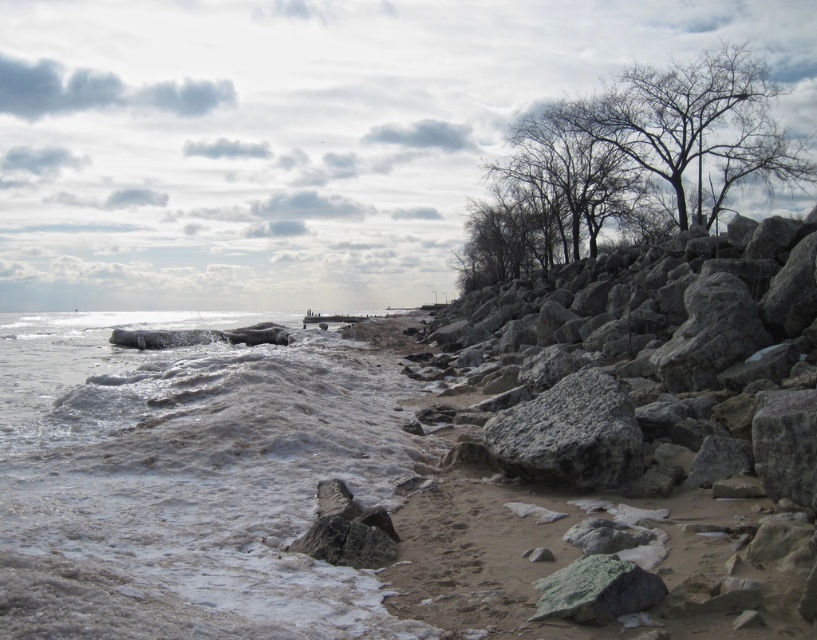
Is white frothy water at lower left in front of bare branches at upper right?

Yes, it is in front of bare branches at upper right.

Who is more distant from viewer, [192,458] or [570,120]?

The point [570,120] is behind.

Between point (240, 532) and point (653, 160), which one is positioned behind?

Positioned behind is point (653, 160).

At what (x,y) coordinates should I click in order to perform the action: click on white frothy water at lower left. Please return your answer as a coordinate pair (x, y). The height and width of the screenshot is (640, 817). Looking at the image, I should click on (184, 481).

Is white frothy water at lower left to the left of gray rough rock at center-right from the viewer's perspective?

Yes, white frothy water at lower left is to the left of gray rough rock at center-right.

Between white frothy water at lower left and gray rough rock at center-right, which one has less height?

gray rough rock at center-right

Does point (324, 381) lie behind point (587, 408)?

Yes, point (324, 381) is farther from viewer.

This screenshot has width=817, height=640. I want to click on white frothy water at lower left, so click(x=184, y=481).

Does point (621, 150) come farther from viewer compared to point (636, 474)?

Yes, it is behind point (636, 474).

Who is higher up, bare branches at upper right or gray rough rock at center-right?

Positioned higher is bare branches at upper right.

Does point (637, 65) lie behind point (581, 400)?

Yes, point (637, 65) is behind point (581, 400).

This screenshot has width=817, height=640. In order to click on bare branches at upper right in this screenshot , I will do `click(628, 163)`.